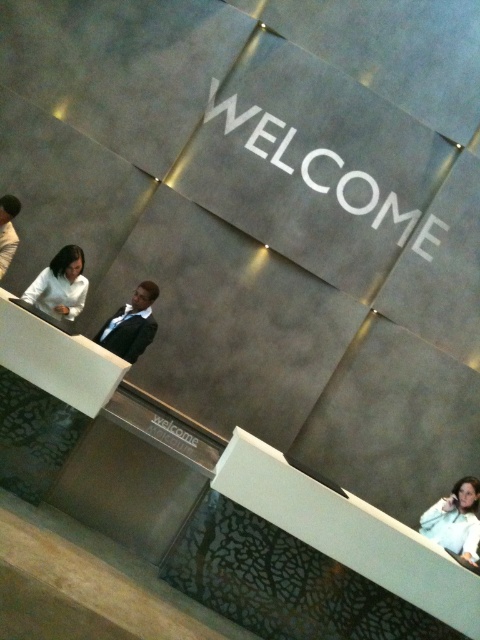
You are standing in the modern office reception area described. You need to locate the black suit at center. According to the scene, where exactly is the black suit positioned relative to the other objects?

The black suit at center is located at point coordinates (131, 324).

Based on the photo, you are standing in the office scene described. You need to locate the white matte jacket at lower right. According to the coordinates provided, where exactly is it positioned?

The white matte jacket at lower right is positioned at point 0.814 on the x axis and 0.948 on the y axis.

You are a security guard in the office and need to check both the black suit at center and the black suit at left. Which one is directly below the other?

The black suit at center is positioned under the black suit at left, so the black suit at center is directly below the black suit at left.